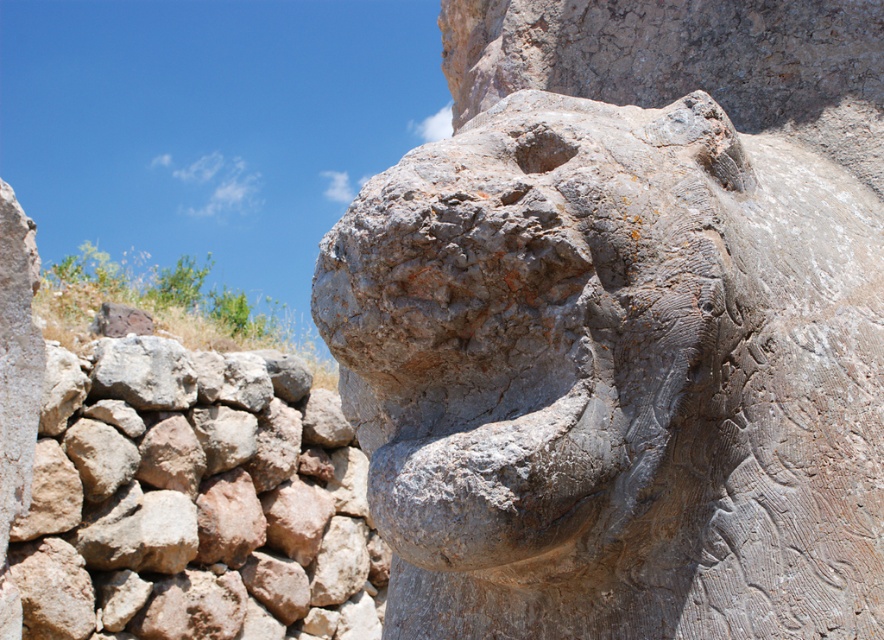
From the picture: You are standing in front of the stone sculpture and want to touch the point at coordinates point (61, 449) and point (147, 371). Which point will you reach first if you move towards them?

Point (61, 449) is in front of point (147, 371), so you will reach point (61, 449) first.

You are an art conservator examining the gray stone lion head at center and the gray rough rock at lower left in the image. Which object is located to the right of the other?

The gray stone lion head at center is positioned on the right side of gray rough rock at lower left, so the gray stone lion head at center is to the right of the gray rough rock at lower left.

You are an architect examining the stone sculpture and wall in the image. You need to determine the spatial relationship between them. Is the gray stone lion head at center positioned higher or lower than the rustic stone wall at left?

The gray stone lion head at center is located above the rustic stone wall at left, meaning it is positioned higher than the wall.